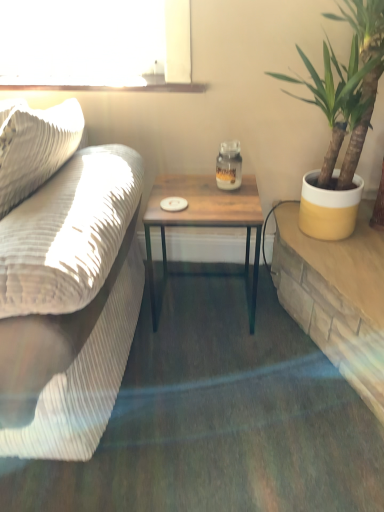
Locate an element on the screen. clear glass window sill at upper center is located at coordinates (110, 88).

Measure the distance between wooden table at center and camera.

wooden table at center is 1.40 meters away from camera.

I want to click on wooden table at right, so click(x=336, y=296).

Measure the distance between point [230,154] and camera.

The depth of point [230,154] is 5.03 feet.

Describe the element at coordinates (229, 165) in the screenshot. This screenshot has height=512, width=384. I see `matte glass jar at center` at that location.

You are a GUI agent. You are given a task and a screenshot of the screen. Output one action in this format:
    pyautogui.click(x=<x>, y=<y>)
    Task: Click on the matte beige couch at left
    Image resolution: width=384 pixels, height=512 pixels.
    Given the screenshot: What is the action you would take?
    pyautogui.click(x=70, y=301)

From the image's perspective, relative to matte beige couch at left, is wooden table at right above or below?

From the image's perspective, wooden table at right appears below matte beige couch at left.

How different are the orientations of wooden table at right and matte beige couch at left in degrees?

They differ by 21.2 degrees in their facing directions.

Is wooden table at right shorter than matte beige couch at left?

Correct, wooden table at right is not as tall as matte beige couch at left.

In the image, there is a matte beige couch at left. Where is `table below it (from a real-world perspective)`? This screenshot has width=384, height=512. table below it (from a real-world perspective) is located at coordinates (336, 296).

Does wooden table at center come behind yellow ceramic pot at right?

Yes, it is.

Based on their sizes in the image, would you say wooden table at center is bigger or smaller than yellow ceramic pot at right?

Considering their sizes, wooden table at center takes up less space than yellow ceramic pot at right.

Which object is wider, wooden table at center or yellow ceramic pot at right?

yellow ceramic pot at right.

Is wooden table at center facing away from clear glass window sill at upper center?

No, wooden table at center's orientation is not away from clear glass window sill at upper center.

Between wooden table at center and clear glass window sill at upper center, which one is positioned behind?

clear glass window sill at upper center.

Is wooden table at center with clear glass window sill at upper center?

wooden table at center and clear glass window sill at upper center are clearly separated.

In the scene shown: Is wooden table at center surrounding clear glass window sill at upper center?

No, clear glass window sill at upper center is not inside wooden table at center.

In the scene shown: From the image's perspective, which is below, wooden table at right or yellow ceramic pot at right?

wooden table at right is shown below in the image.

Between wooden table at right and yellow ceramic pot at right, which one appears on the right side from the viewer's perspective?

From the viewer's perspective, wooden table at right appears more on the right side.

From a real-world perspective, who is located higher, wooden table at right or yellow ceramic pot at right?

From a 3D spatial view, yellow ceramic pot at right is above.

Is point (73, 380) farther from camera compared to point (362, 28)?

That is False.

Based on their sizes in the image, would you say matte beige couch at left is bigger or smaller than yellow ceramic pot at right?

Considering their sizes, matte beige couch at left takes up more space than yellow ceramic pot at right.

Is matte beige couch at left next to yellow ceramic pot at right and touching it?

There is a gap between matte beige couch at left and yellow ceramic pot at right.

Identify the location of houseplant that is above the matte beige couch at left (from the image's perspective). This screenshot has width=384, height=512. [348, 88].

Based on the photo, is wooden table at right oriented away from matte glass jar at center?

wooden table at right is not turned away from matte glass jar at center.

Which is closer, (364, 338) or (227, 161)?

The point (364, 338) is more forward.

From a real-world perspective, is wooden table at right positioned above or below matte glass jar at center?

wooden table at right is situated lower than matte glass jar at center in the real world.

Considering the sizes of wooden table at right and matte glass jar at center in the image, is wooden table at right wider or thinner than matte glass jar at center?

In the image, wooden table at right appears to be wider than matte glass jar at center.

Which is closer to the camera, (2, 89) or (235, 184)?

Positioned in front is point (235, 184).

Can you tell me how much clear glass window sill at upper center and matte glass jar at center differ in facing direction?

0.435 degrees separate the facing orientations of clear glass window sill at upper center and matte glass jar at center.

Based on the photo, which object is positioned more to the right, clear glass window sill at upper center or matte glass jar at center?

matte glass jar at center.

Is clear glass window sill at upper center not close to matte glass jar at center?

No, clear glass window sill at upper center is not far away from matte glass jar at center.

Where is `table below the matte beige couch at left (from the image's perspective)`? table below the matte beige couch at left (from the image's perspective) is located at coordinates (336, 296).

Find the location of a particular element. This screenshot has height=512, width=384. houseplant that appears above the wooden table at center (from a real-world perspective) is located at coordinates (348, 88).

Looking at the image, which one is located closer to yellow ceramic pot at right, matte glass jar at center or matte beige couch at left?

Based on the image, matte glass jar at center appears to be nearer to yellow ceramic pot at right.

Considering their positions, is matte beige couch at left positioned closer to wooden table at center than matte glass jar at center?

matte glass jar at center.

Considering their positions, is yellow ceramic pot at right positioned closer to wooden table at right than matte glass jar at center?

Based on the image, yellow ceramic pot at right appears to be nearer to wooden table at right.

When comparing their distances from matte glass jar at center, does matte beige couch at left or wooden table at center seem closer?

wooden table at center is positioned closer to the anchor matte glass jar at center.

When comparing their distances from wooden table at center, does wooden table at right or clear glass window sill at upper center seem closer?

wooden table at right lies closer to wooden table at center than the other object.

When comparing their distances from wooden table at right, does wooden table at center or clear glass window sill at upper center seem further?

Among the two, clear glass window sill at upper center is located further to wooden table at right.

Looking at the image, which one is located further to clear glass window sill at upper center, matte glass jar at center or yellow ceramic pot at right?

yellow ceramic pot at right lies further to clear glass window sill at upper center than the other object.

When comparing their distances from clear glass window sill at upper center, does wooden table at right or matte beige couch at left seem further?

wooden table at right is further to clear glass window sill at upper center.

Locate an element on the screen. The width and height of the screenshot is (384, 512). window sill situated between matte beige couch at left and yellow ceramic pot at right from left to right is located at coordinates (110, 88).

I want to click on coffee cup between clear glass window sill at upper center and yellow ceramic pot at right in the horizontal direction, so coord(229,165).

You are a GUI agent. You are given a task and a screenshot of the screen. Output one action in this format:
    pyautogui.click(x=<x>, y=<y>)
    Task: Click on the coffee cup situated between matte beige couch at left and yellow ceramic pot at right from left to right
    The image size is (384, 512).
    Given the screenshot: What is the action you would take?
    pyautogui.click(x=229, y=165)

Where is `coffee table between matte beige couch at left and yellow ceramic pot at right`? coffee table between matte beige couch at left and yellow ceramic pot at right is located at coordinates (204, 219).